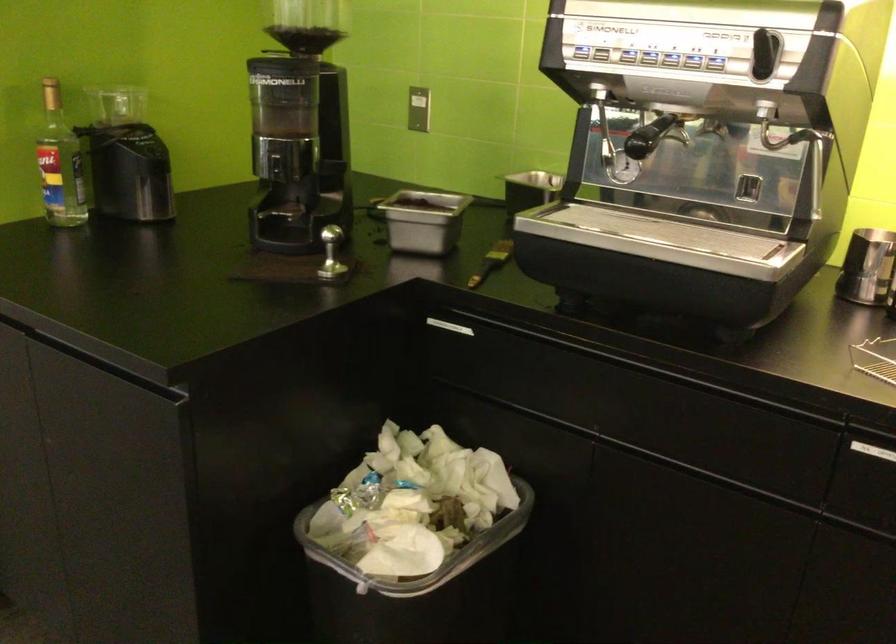
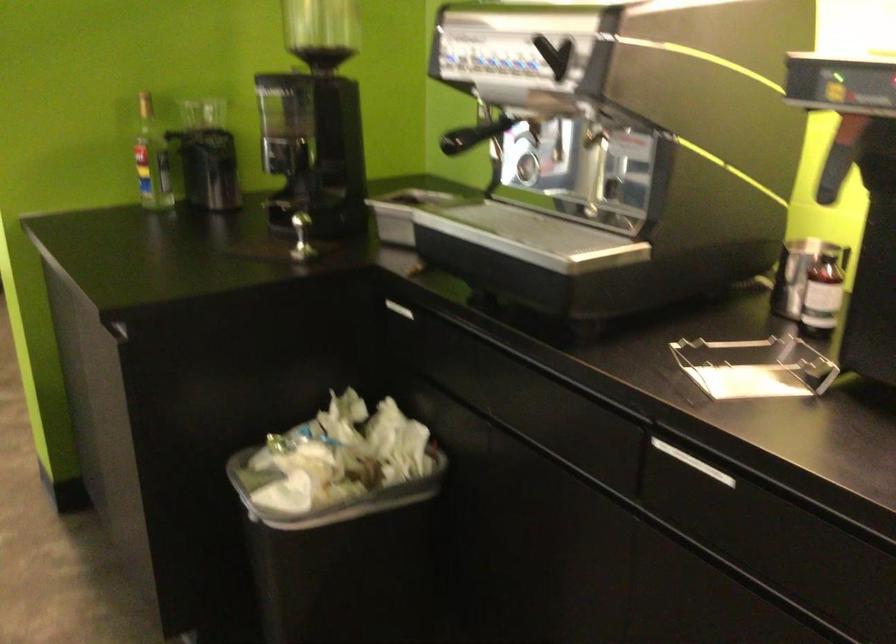
In the second image, find the point that corresponds to (427,550) in the first image.

(328, 495)